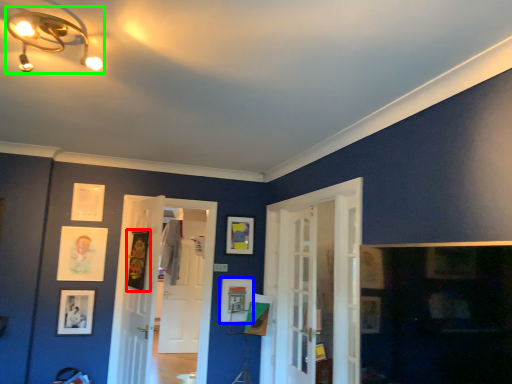
Question: Estimate the real-world distances between objects in this image. Which object is closer to picture frame (highlighted by a red box), picture frame (highlighted by a blue box) or light fixture (highlighted by a green box)?

Choices:
 (A) picture frame
 (B) light fixture

Answer: (A)